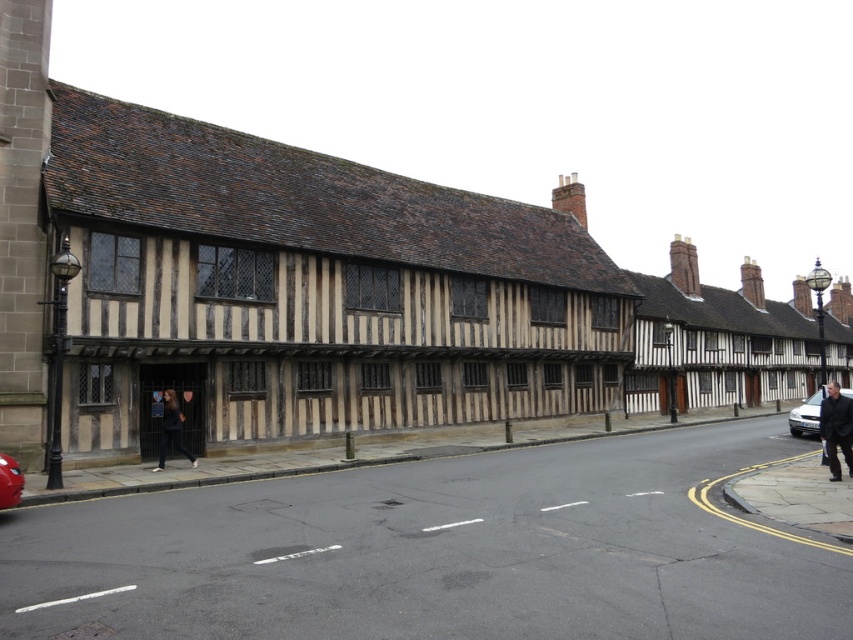
You are a delivery driver who needs to park your silver metallic sedan at right in a spot that is not occupied. Based on the scene, where should you park?

The silver metallic sedan at right is already parked at point (805,416), so you should look for an unoccupied parking spot elsewhere along the street or in a nearby lot.

You are a pedestrian standing at the edge of the street. You see a black fabric coat at lower right and a silver metallic sedan at right. If the sedan starts moving forward, will it hit the coat?

The distance between the black fabric coat at lower right and the silver metallic sedan at right is 5.37 meters. Since the sedan is 4.5 meters long, it will not hit the coat when moving forward as there is enough space between them.

You are a pedestrian standing on the street in the image. You see a point at coordinates (836, 428). What object is located at that point?

The point at coordinates (836, 428) is located on the black fabric coat at lower right.